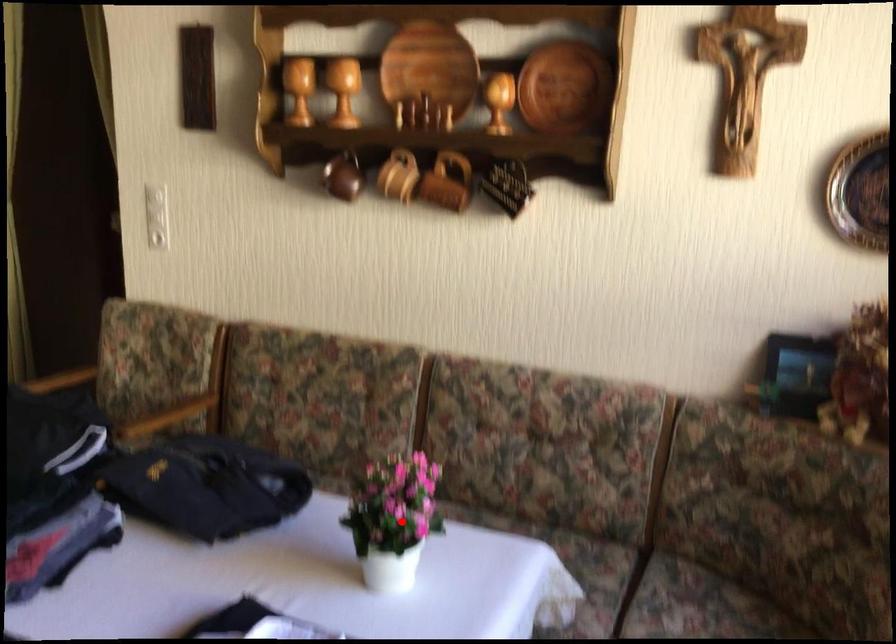
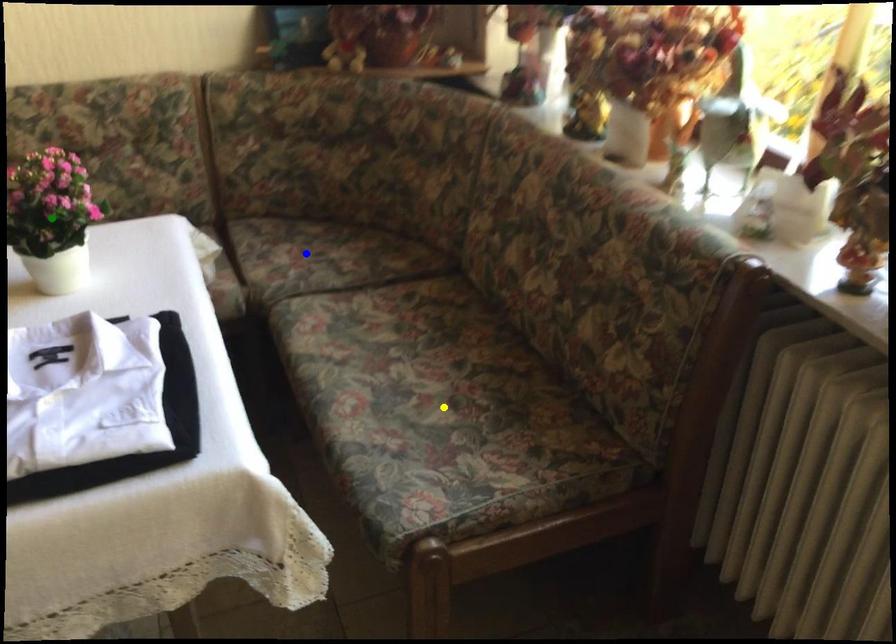
Question: I am providing you with two images of the same scene from different viewpoints. A red point is marked on the first image. You are given multiple points on the second image. In image 2, which mark is for the same physical point as the one in image 1?

Choices:
 (A) yellow point
 (B) green point
 (C) blue point

Answer: (B)